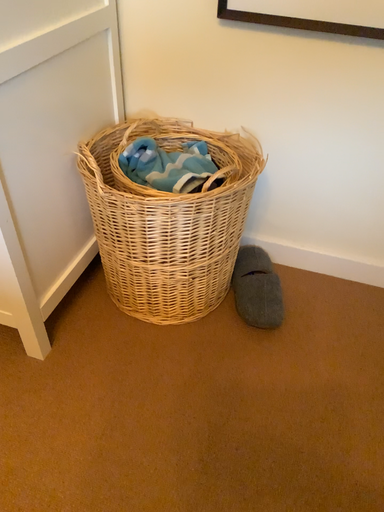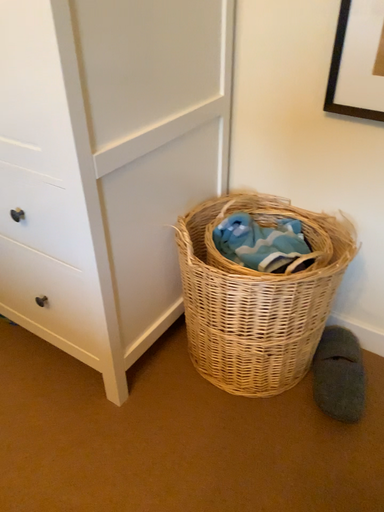
Question: How did the camera likely rotate when shooting the video?

Choices:
 (A) rotated left
 (B) rotated right

Answer: (A)